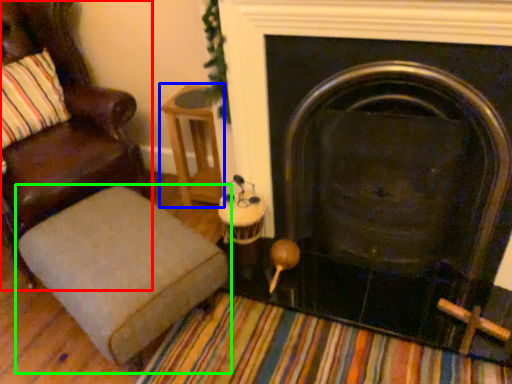
Question: Which object is positioned closest to chair (highlighted by a red box)? Select from side table (highlighted by a blue box) and furniture (highlighted by a green box).

Choices:
 (A) side table
 (B) furniture

Answer: (A)